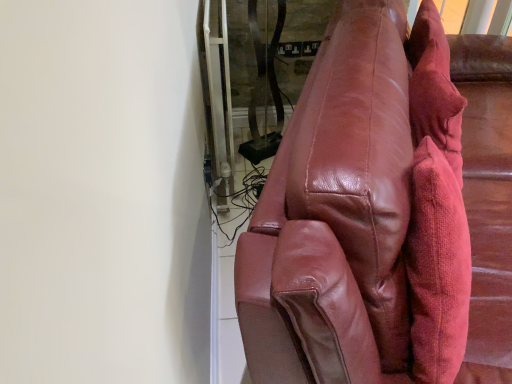
What do you see at coordinates (385, 212) in the screenshot? I see `shiny leather couch at right` at bounding box center [385, 212].

Image resolution: width=512 pixels, height=384 pixels. In order to click on shiny leather couch at right in this screenshot , I will do `click(385, 212)`.

This screenshot has width=512, height=384. I want to click on shiny leather couch at right, so click(385, 212).